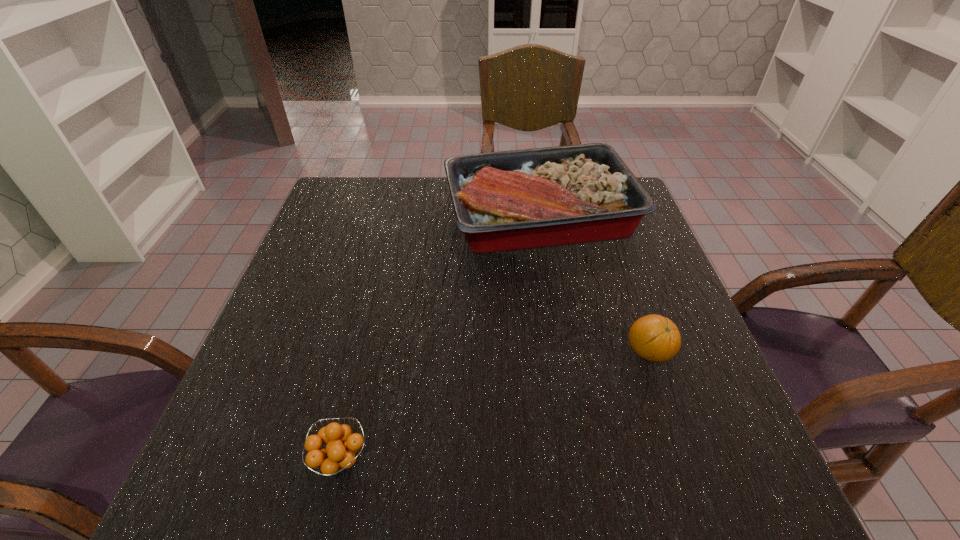
Locate an element on the screen. The image size is (960, 540). tray is located at coordinates (510, 200).

Where is `the tallest object`? The image size is (960, 540). the tallest object is located at coordinates (510, 200).

The width and height of the screenshot is (960, 540). What are the coordinates of `the second shortest object` in the screenshot? It's located at (654, 338).

Where is `the second nearest object`? The image size is (960, 540). the second nearest object is located at coordinates (654, 338).

The image size is (960, 540). I want to click on the left orange fruit, so click(336, 456).

This screenshot has width=960, height=540. What are the coordinates of `the shortest object` in the screenshot? It's located at (336, 456).

The image size is (960, 540). I want to click on vacant area situated on the front of the tallest object, so click(551, 289).

Where is `vacant area located 0.130m on the back of the farther orange fruit`? The height and width of the screenshot is (540, 960). vacant area located 0.130m on the back of the farther orange fruit is located at coordinates (627, 291).

Identify the location of vacant space located on the right of the nearer orange fruit. The height and width of the screenshot is (540, 960). (460, 458).

This screenshot has height=540, width=960. I want to click on object that is at the far edge, so pyautogui.click(x=510, y=200).